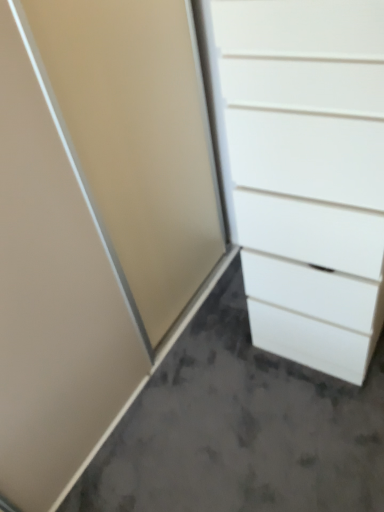
The image size is (384, 512). Describe the element at coordinates (240, 428) in the screenshot. I see `white matte concrete at lower right` at that location.

Where is `white matte concrete at lower right`? This screenshot has width=384, height=512. white matte concrete at lower right is located at coordinates (240, 428).

Measure the distance between white matte chest of drawers at right and camera.

They are 28.17 inches apart.

The height and width of the screenshot is (512, 384). Describe the element at coordinates (306, 172) in the screenshot. I see `white matte chest of drawers at right` at that location.

Locate an element on the screen. Image resolution: width=384 pixels, height=512 pixels. white matte chest of drawers at right is located at coordinates (306, 172).

Where is `white matte concrete at lower right`? Image resolution: width=384 pixels, height=512 pixels. white matte concrete at lower right is located at coordinates (240, 428).

Which object is positioned more to the left, white matte concrete at lower right or white matte chest of drawers at right?

From the viewer's perspective, white matte concrete at lower right appears more on the left side.

In the image, is white matte concrete at lower right positioned in front of or behind white matte chest of drawers at right?

In the image, white matte concrete at lower right appears behind white matte chest of drawers at right.

Is point (253, 419) positioned behind point (230, 225)?

Yes, it is.

From the image's perspective, between white matte concrete at lower right and white matte chest of drawers at right, which one is located above?

white matte chest of drawers at right.

From a real-world perspective, does white matte concrete at lower right sit lower than white matte chest of drawers at right?

Yes, from a real-world perspective, white matte concrete at lower right is beneath white matte chest of drawers at right.

Considering the sizes of white matte concrete at lower right and white matte chest of drawers at right in the image, is white matte concrete at lower right wider or thinner than white matte chest of drawers at right?

Considering their sizes, white matte concrete at lower right looks broader than white matte chest of drawers at right.

Is white matte concrete at lower right taller than white matte chest of drawers at right?

In fact, white matte concrete at lower right may be shorter than white matte chest of drawers at right.

Based on the photo, considering the sizes of objects white matte concrete at lower right and white matte chest of drawers at right in the image provided, who is smaller, white matte concrete at lower right or white matte chest of drawers at right?

Smaller between the two is white matte concrete at lower right.

Is white matte concrete at lower right not inside white matte chest of drawers at right?

Yes.

Are white matte concrete at lower right and white matte chest of drawers at right beside each other?

No, white matte concrete at lower right is not making contact with white matte chest of drawers at right.

Is white matte concrete at lower right aimed at white matte chest of drawers at right?

Yes, white matte concrete at lower right is turned towards white matte chest of drawers at right.

Measure the distance from white matte concrete at lower right to white matte chest of drawers at right.

white matte concrete at lower right and white matte chest of drawers at right are 16.07 inches apart.

Where is `concrete beneath the white matte chest of drawers at right (from a real-world perspective)`? The height and width of the screenshot is (512, 384). concrete beneath the white matte chest of drawers at right (from a real-world perspective) is located at coordinates click(240, 428).

Which object is positioned more to the left, white matte chest of drawers at right or white matte concrete at lower right?

white matte concrete at lower right is more to the left.

Is white matte chest of drawers at right closer to camera compared to white matte concrete at lower right?

Yes, white matte chest of drawers at right is closer to the viewer.

Is point (358, 91) closer or farther from the camera than point (234, 462)?

Point (358, 91) is positioned closer to the camera compared to point (234, 462).

From the image's perspective, is white matte chest of drawers at right over white matte concrete at lower right?

Yes, from the image's perspective, white matte chest of drawers at right is over white matte concrete at lower right.

From a real-world perspective, is white matte chest of drawers at right on white matte concrete at lower right?

Yes, from a real-world perspective, white matte chest of drawers at right is above white matte concrete at lower right.

Which object is thinner, white matte chest of drawers at right or white matte concrete at lower right?

white matte chest of drawers at right.

Between white matte chest of drawers at right and white matte concrete at lower right, which one has more height?

white matte chest of drawers at right.

Can you confirm if white matte chest of drawers at right is bigger than white matte concrete at lower right?

Yes, white matte chest of drawers at right is bigger than white matte concrete at lower right.

Can we say white matte chest of drawers at right lies outside white matte concrete at lower right?

Yes.

Based on the photo, is there a large distance between white matte chest of drawers at right and white matte concrete at lower right?

No.

Is white matte chest of drawers at right looking in the opposite direction of white matte concrete at lower right?

That's not correct — white matte chest of drawers at right is not looking away from white matte concrete at lower right.

From the picture: Can you tell me how much white matte chest of drawers at right and white matte concrete at lower right differ in facing direction?

The angle between the facing direction of white matte chest of drawers at right and the facing direction of white matte concrete at lower right is 180 degrees.

Measure the distance between white matte chest of drawers at right and white matte concrete at lower right.

white matte chest of drawers at right is 16.07 inches from white matte concrete at lower right.

Identify the location of chest of drawers in front of the white matte concrete at lower right. This screenshot has width=384, height=512. (306, 172).

In order to click on chest of drawers above the white matte concrete at lower right (from the image's perspective) in this screenshot , I will do pos(306,172).

You are a GUI agent. You are given a task and a screenshot of the screen. Output one action in this format:
    pyautogui.click(x=<x>, y=<y>)
    Task: Click on the concrete that appears below the white matte chest of drawers at right (from a real-world perspective)
    This screenshot has height=512, width=384.
    Given the screenshot: What is the action you would take?
    pyautogui.click(x=240, y=428)